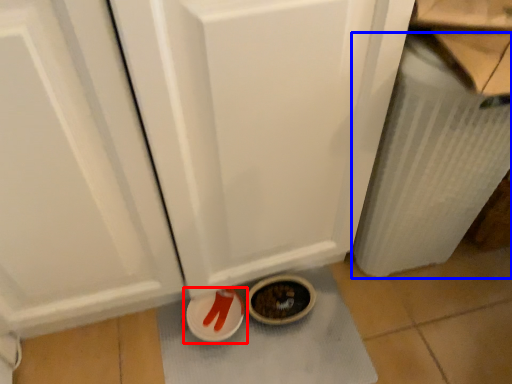
Question: Which of the following is the closest to the observer, footwear (highlighted by a red box) or radiator (highlighted by a blue box)?

Choices:
 (A) footwear
 (B) radiator

Answer: (B)